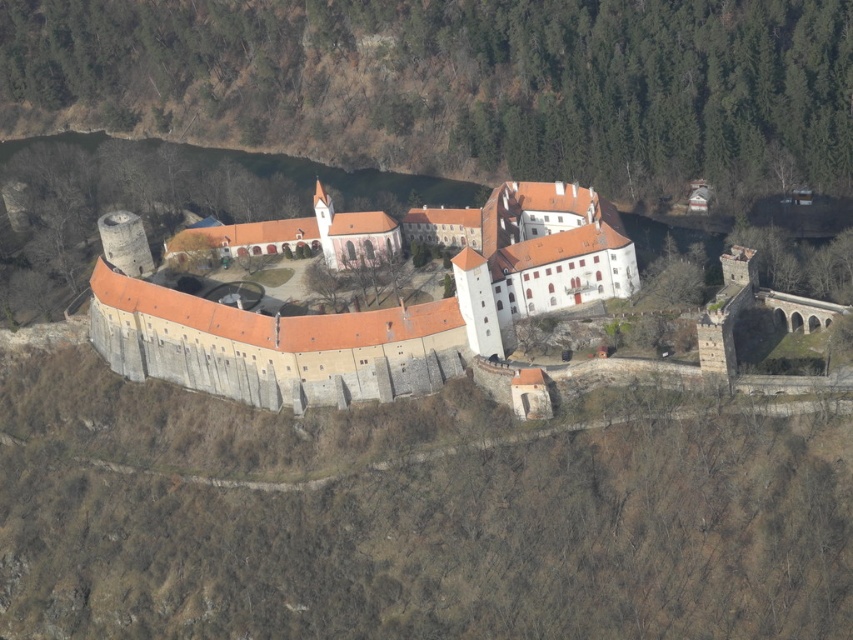
Question: Considering the relative positions of brown stone castle at center and white stone monastery at center in the image provided, where is brown stone castle at center located with respect to white stone monastery at center?

Choices:
 (A) right
 (B) left

Answer: (B)

Question: Does brown stone castle at center appear on the left side of white stone monastery at center?

Choices:
 (A) no
 (B) yes

Answer: (B)

Question: Among these points, which one is nearest to the camera?

Choices:
 (A) (471, 308)
 (B) (614, 147)

Answer: (A)

Question: Which point is closer to the camera?

Choices:
 (A) (283, 72)
 (B) (172, 340)

Answer: (B)

Question: Which point appears farthest from the camera in this image?

Choices:
 (A) (305, 340)
 (B) (786, 72)

Answer: (B)

Question: Is brown stone castle at center closer to the viewer compared to white stone monastery at center?

Choices:
 (A) no
 (B) yes

Answer: (A)